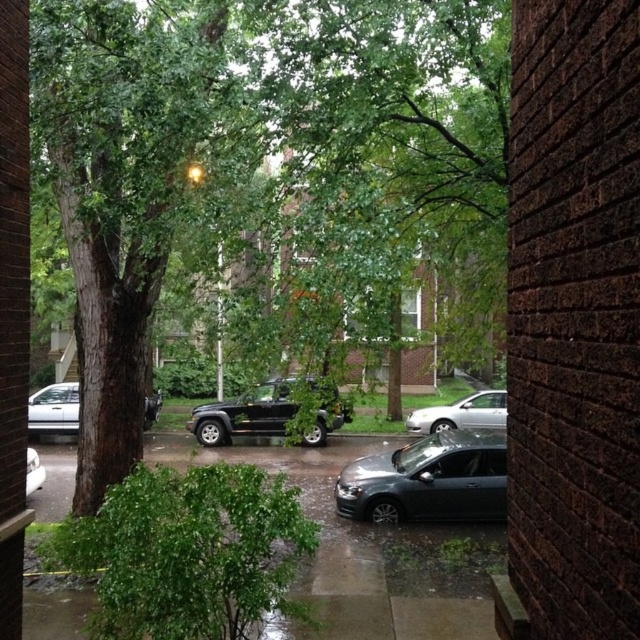
You are standing at the corner of the street and want to locate the shiny black suv at center. According to the coordinates given, where would you find it?

The shiny black suv at center is located at the 2D coordinates point of (x=244, y=413).

You are a pedestrian trying to cross the street between the satin black sedan at center and the shiny black suv at center. Which direction should you walk to avoid the parked cars?

You should walk to the left of the shiny black suv at center since the satin black sedan at center is to the right of it, so moving left would keep you between the two vehicles and away from traffic.

You are standing on the sidewalk in the rainy urban scene between two brick buildings. You see two points marked in the image. The first point is at coordinates point (340, 486) and the second is at point (278, 410). Which point is closer to you?

Point (340, 486) is closer to the viewer than point (278, 410).